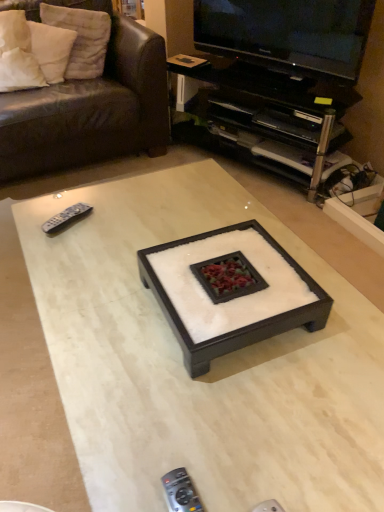
Question: Is white soft pillow at upper left, the second pillow when ordered from right to left, aimed at leather couch at upper left?

Choices:
 (A) yes
 (B) no

Answer: (A)

Question: Is white soft pillow at upper left, the first pillow in the left-to-right sequence, in front of leather couch at upper left?

Choices:
 (A) yes
 (B) no

Answer: (B)

Question: From the image's perspective, does white soft pillow at upper left, the first pillow in the left-to-right sequence, appear lower than leather couch at upper left?

Choices:
 (A) no
 (B) yes

Answer: (A)

Question: Is white soft pillow at upper left, the first pillow in the left-to-right sequence, outside of leather couch at upper left?

Choices:
 (A) yes
 (B) no

Answer: (B)

Question: Does white soft pillow at upper left, the second pillow when ordered from right to left, appear on the left side of leather couch at upper left?

Choices:
 (A) yes
 (B) no

Answer: (A)

Question: Based on their positions, is white cotton pillow at upper left, placed as the 1th pillow when sorted from right to left, located to the left or right of gray plastic remote at left, acting as the 2th remote control starting from the front?

Choices:
 (A) right
 (B) left

Answer: (B)

Question: Is white cotton pillow at upper left, the second pillow in the left-to-right sequence, bigger or smaller than gray plastic remote at left, the second remote control from the right?

Choices:
 (A) big
 (B) small

Answer: (A)

Question: From the image's perspective, is white cotton pillow at upper left, the second pillow in the left-to-right sequence, located above or below gray plastic remote at left, the first remote control viewed from the left?

Choices:
 (A) above
 (B) below

Answer: (A)

Question: Is white cotton pillow at upper left, the second pillow in the left-to-right sequence, taller or shorter than gray plastic remote at left, the first remote control viewed from the left?

Choices:
 (A) short
 (B) tall

Answer: (B)

Question: From the image's perspective, is white felt square tray at center, the 2th coffee table positioned from the bottom, above or below black plastic remote control at lower center, placed as the 1th remote control when sorted from front to back?

Choices:
 (A) below
 (B) above

Answer: (B)

Question: Looking at the image, does white felt square tray at center, positioned as the first coffee table in top-to-bottom order, seem bigger or smaller compared to black plastic remote control at lower center, which is the first remote control from bottom to top?

Choices:
 (A) small
 (B) big

Answer: (B)

Question: In terms of width, does white felt square tray at center, positioned as the first coffee table in top-to-bottom order, look wider or thinner when compared to black plastic remote control at lower center, which is the first remote control from right to left?

Choices:
 (A) wide
 (B) thin

Answer: (A)

Question: From a real-world perspective, is white felt square tray at center, the 2th coffee table positioned from the bottom, above or below black plastic remote control at lower center, which is the first remote control from right to left?

Choices:
 (A) below
 (B) above

Answer: (B)

Question: Is white felt square tray at center, positioned as the first coffee table in top-to-bottom order, in front of or behind black glossy television at upper right in the image?

Choices:
 (A) front
 (B) behind

Answer: (A)

Question: In terms of size, does white felt square tray at center, the 2th coffee table positioned from the bottom, appear bigger or smaller than black glossy television at upper right?

Choices:
 (A) big
 (B) small

Answer: (B)